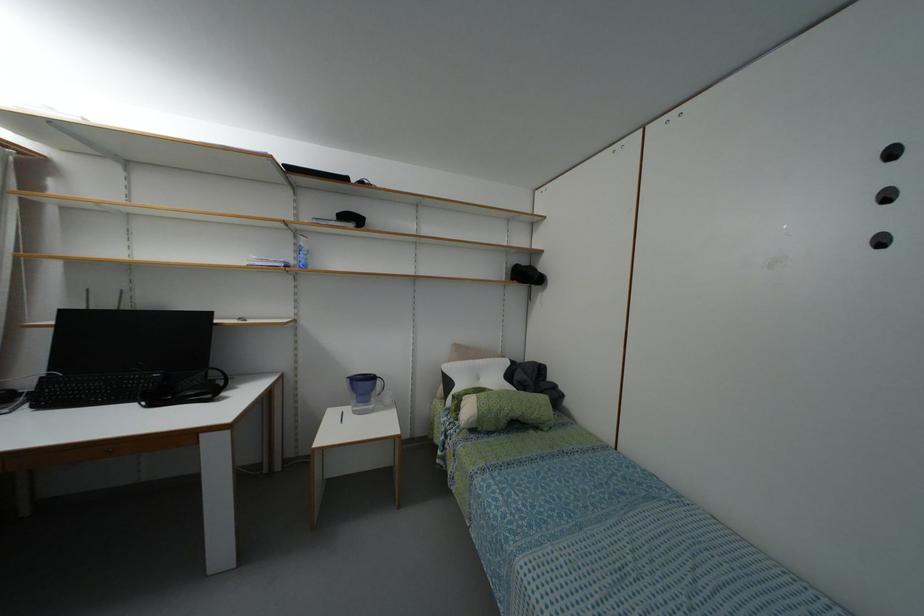
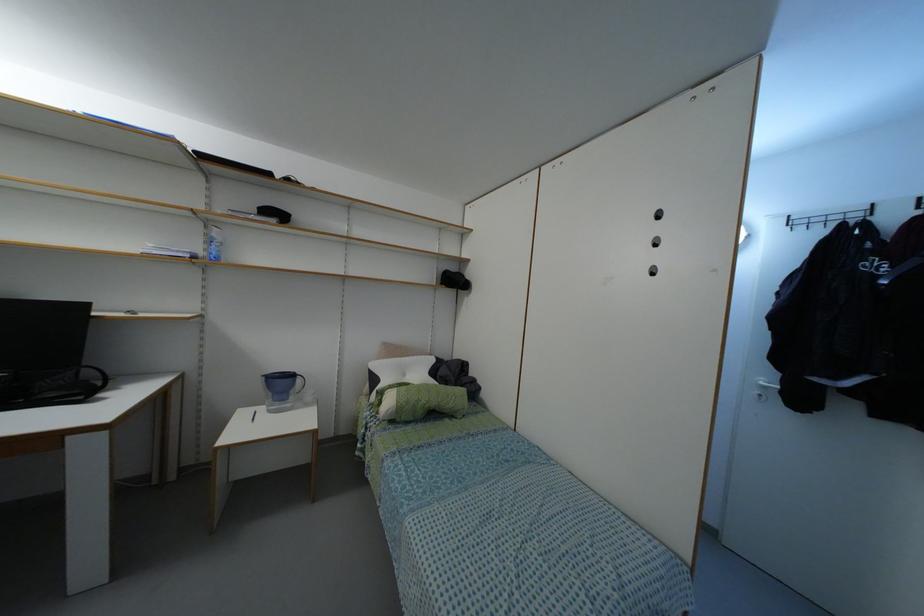
Question: The images are taken continuously from a first-person perspective. In which direction is your viewpoint rotating?

Choices:
 (A) Left
 (B) Right
 (C) Up
 (D) Down

Answer: (B)